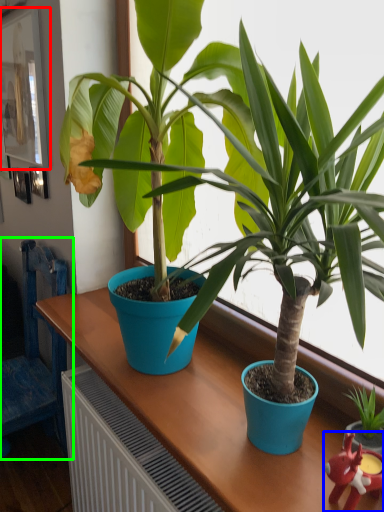
Question: Considering the real-world distances, which object is closest to picture frame (highlighted by a red box)? toy (highlighted by a blue box) or chair (highlighted by a green box).

Choices:
 (A) toy
 (B) chair

Answer: (B)